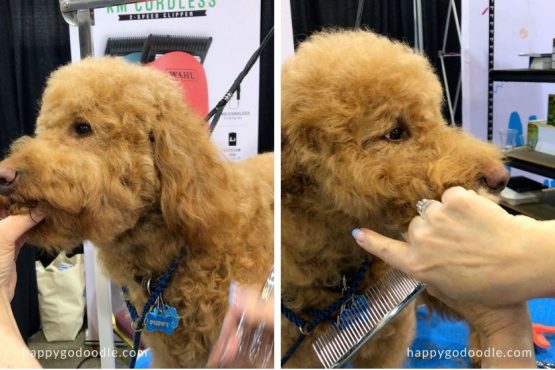
Find the location of a particular element. Image resolution: width=555 pixels, height=370 pixels. bag on floor is located at coordinates (52, 296).